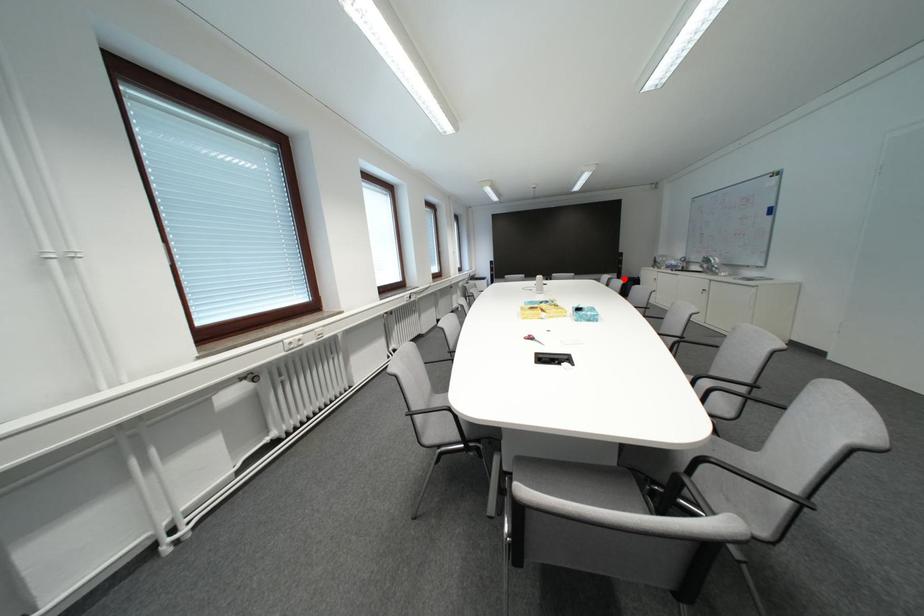
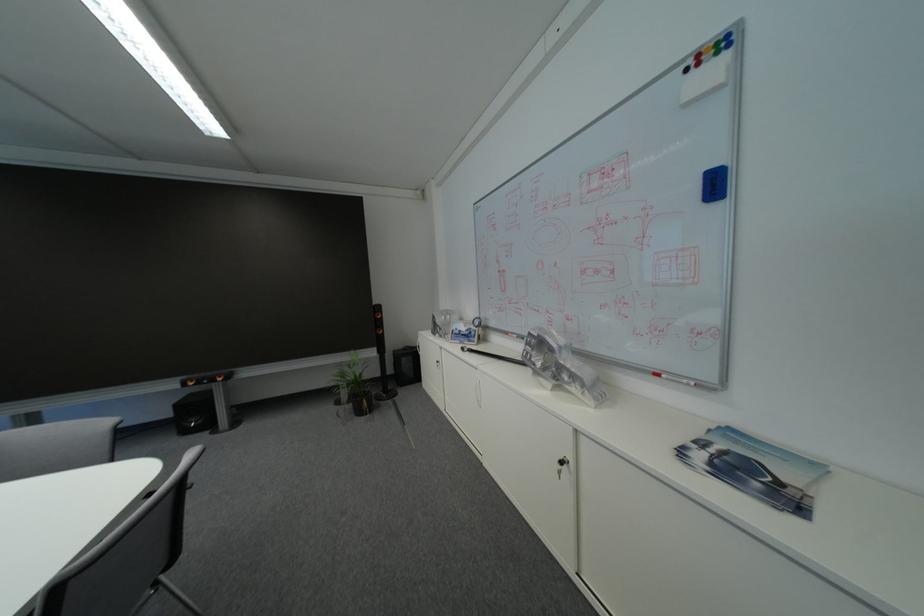
Question: I am providing you with two images of the same scene from different viewpoints. Given a red point in image1, look at the same physical point in image2. Is it:

Choices:
 (A) Closer to the viewpoint
 (B) Farther from the viewpoint

Answer: (A)